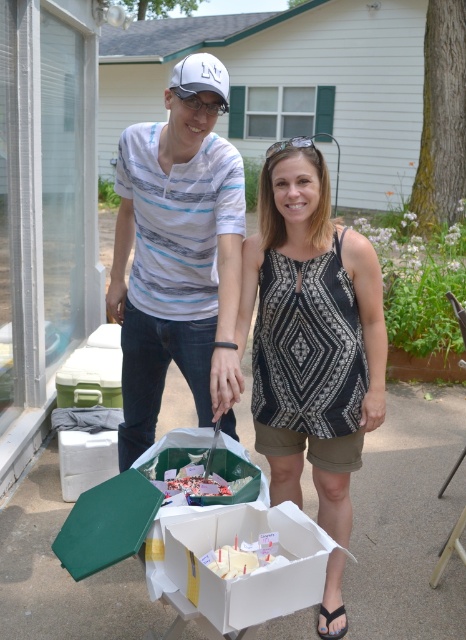
Question: Does white frosted cake at center come behind smooth white cake at center?

Choices:
 (A) yes
 (B) no

Answer: (B)

Question: Can you confirm if white cardboard box at center is positioned to the left of smooth white cake at center?

Choices:
 (A) no
 (B) yes

Answer: (A)

Question: Which point is closer to the camera taking this photo?

Choices:
 (A) (355, 348)
 (B) (169, 524)

Answer: (B)

Question: Estimate the real-world distances between objects in this image. Which object is closer to the white frosted cake at center?

Choices:
 (A) black fabric sandal at lower center
 (B) black printed tank top at center
 (C) white cardboard box at center

Answer: (C)

Question: Which of these objects is positioned closest to the striped cotton shirt at center?

Choices:
 (A) white cardboard box at center
 (B) black fabric sandal at lower center
 (C) white printed tank top at center
 (D) black printed tank top at center

Answer: (C)

Question: Can you confirm if white frosted cake at center is smaller than smooth white cake at center?

Choices:
 (A) no
 (B) yes

Answer: (A)